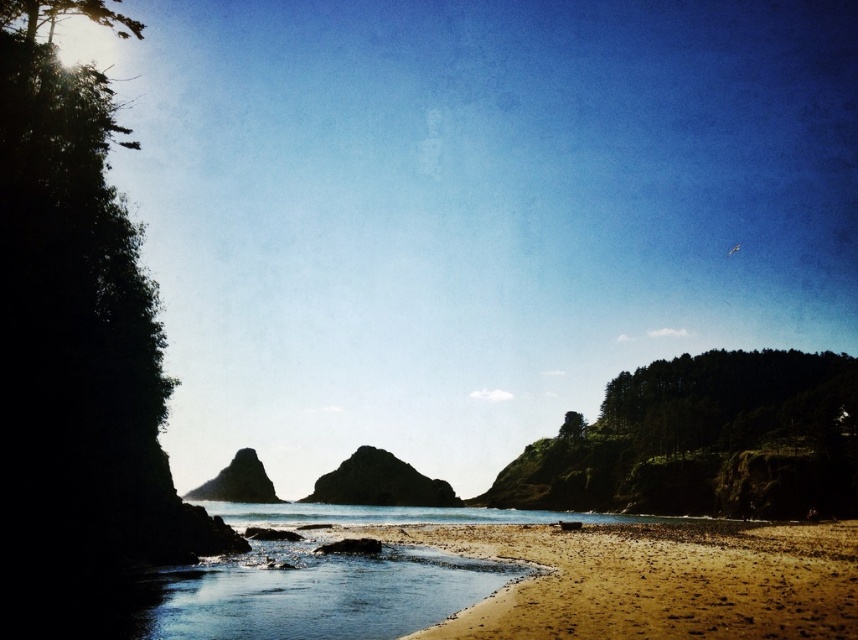
You are standing at the point marked by the coordinates point [651,580]. Looking around, you see the brown sandy beach at lower center. Which direction should you walk to reach the nearest rock formation?

The nearest rock formation is located in the middle ground, which is further away from the brown sandy beach at lower center. Since you are at the point representing the brown sandy beach at lower center, you should walk towards the middle ground to reach the nearest rock formation.

You are standing on the beach and see the dark gray rocky island at center and the smooth gray rock at center. Which one is positioned to the right side from your perspective?

The dark gray rocky island at center is positioned to the right of the smooth gray rock at center.

Based on the photo, you are standing on the brown sandy beach at lower center and want to reach the clear water at lower center. Which direction should you move to get to the water?

The brown sandy beach at lower center is positioned under the clear water at lower center, so you should move upward to reach the clear water at lower center.